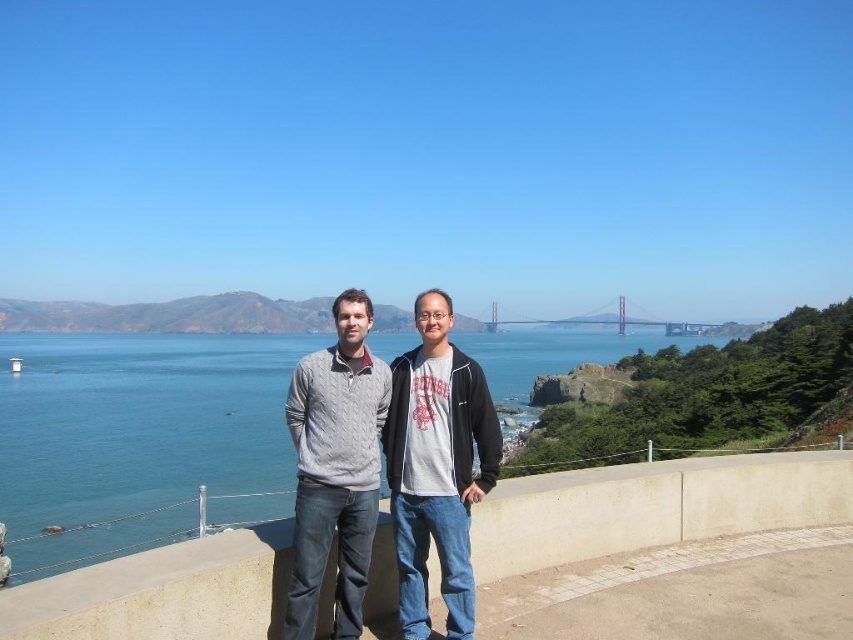
Question: Does blue water at center have a larger size compared to cable-knit sweater at center?

Choices:
 (A) yes
 (B) no

Answer: (A)

Question: Where is blue water at center located in relation to knit sweater at center in the image?

Choices:
 (A) above
 (B) below

Answer: (B)

Question: Which point is closer to the camera?

Choices:
 (A) (527, 323)
 (B) (289, 595)
 (C) (310, 340)

Answer: (B)

Question: Which of the following is the farthest from the observer?

Choices:
 (A) (335, 531)
 (B) (67, 413)
 (C) (709, 330)

Answer: (C)

Question: Estimate the real-world distances between objects in this image. Which object is farther from the cable-knit sweater at center?

Choices:
 (A) knit sweater at center
 (B) concrete ledge at center

Answer: (B)

Question: Is blue water at center to the right of cable-knit sweater at center from the viewer's perspective?

Choices:
 (A) no
 (B) yes

Answer: (A)